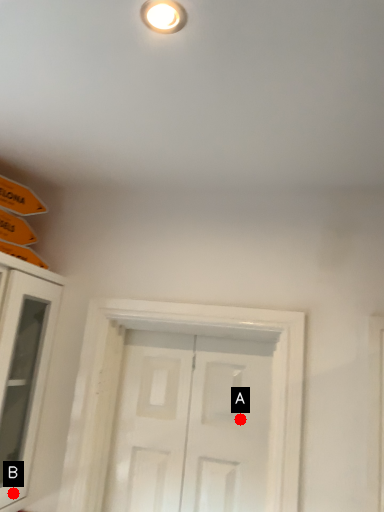
Question: Two points are circled on the image, labeled by A and B beside each circle. Among these points, which one is nearest to the camera?

Choices:
 (A) A is closer
 (B) B is closer

Answer: (B)